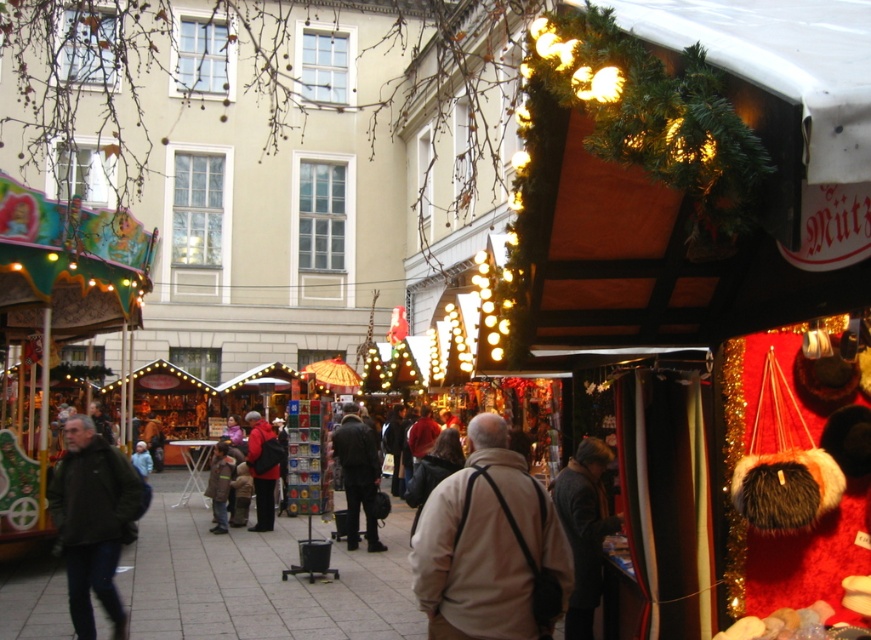
Locate an element on the screen. This screenshot has height=640, width=871. beige fabric jacket at center is located at coordinates (485, 545).

Between point (505, 573) and point (265, 433), which one is positioned behind?

Positioned behind is point (265, 433).

What are the coordinates of `beige fabric jacket at center` in the screenshot? It's located at (485, 545).

Which of these two, beige fabric jacket at center or dark gray wool coat at center, stands shorter?

Standing shorter between the two is beige fabric jacket at center.

Is beige fabric jacket at center wider than dark gray wool coat at center?

Yes.

Between point (514, 496) and point (602, 472), which one is positioned behind?

Point (602, 472)

In order to click on beige fabric jacket at center in this screenshot , I will do `click(485, 545)`.

Is beige fabric jacket at center below dark green jacket at left?

Actually, beige fabric jacket at center is above dark green jacket at left.

Is beige fabric jacket at center to the right of dark green jacket at left from the viewer's perspective?

Indeed, beige fabric jacket at center is positioned on the right side of dark green jacket at left.

Image resolution: width=871 pixels, height=640 pixels. Describe the element at coordinates (485, 545) in the screenshot. I see `beige fabric jacket at center` at that location.

This screenshot has width=871, height=640. I want to click on beige fabric jacket at center, so click(485, 545).